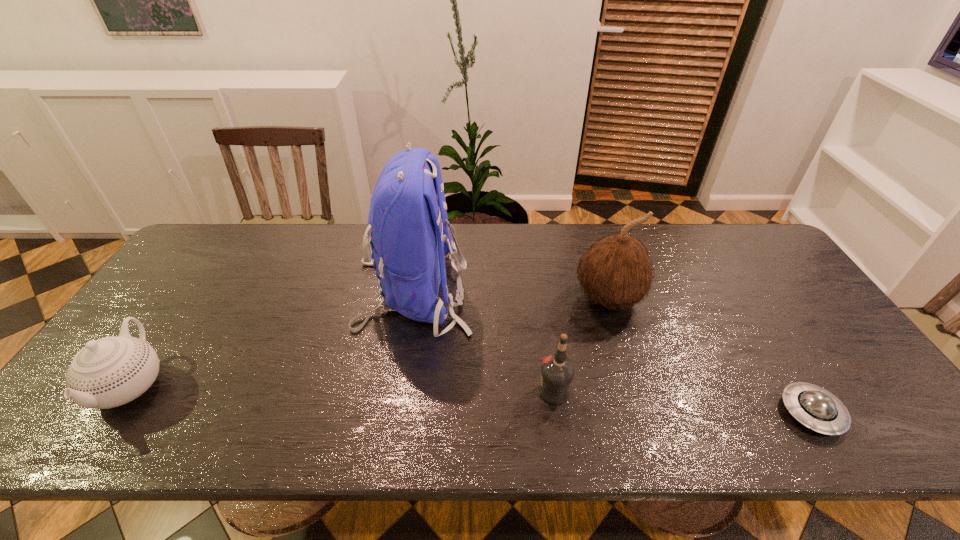
This screenshot has height=540, width=960. Find the location of `the tallest object`. the tallest object is located at coordinates (408, 237).

Locate an element on the screen. Image resolution: width=960 pixels, height=540 pixels. the second object from left to right is located at coordinates (408, 237).

Find the location of a particular element. the fourth shortest object is located at coordinates (616, 271).

Identify the location of the second object from right to left. The image size is (960, 540). (616, 271).

What are the coordinates of `the third tallest object` in the screenshot? It's located at (557, 371).

At what (x,y) coordinates should I click in order to perform the action: click on vodka. Please return your answer as a coordinate pair (x, y). Looking at the image, I should click on (557, 371).

Identify the location of the leftmost object. (109, 372).

Identify the location of chinaware. This screenshot has height=540, width=960. (109, 372).

Identify the location of saucer. [816, 408].

Identify the location of the shortest object. (816, 408).